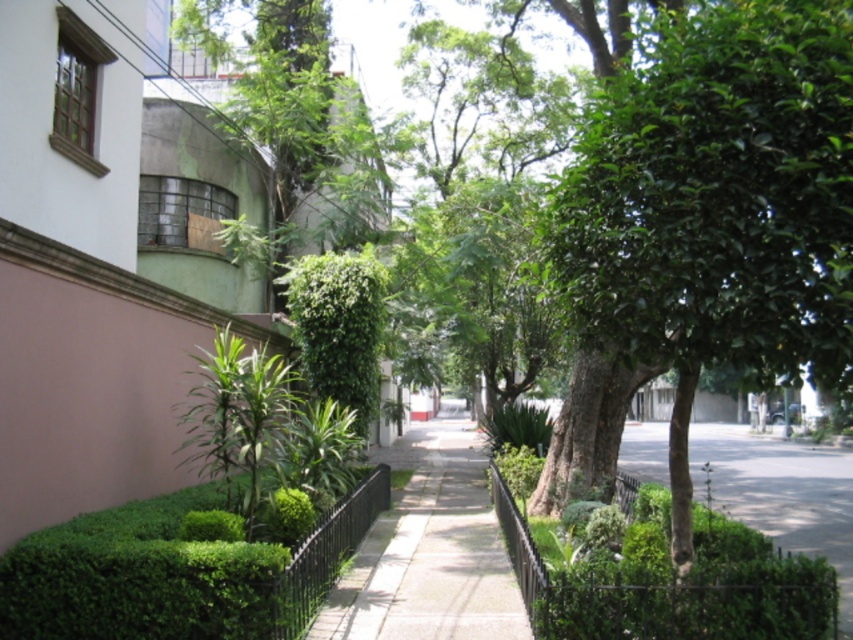
Question: Based on their relative distances, which object is nearer to the paved concrete sidewalk at center?

Choices:
 (A) green leafy tree at center
 (B) green leafy hedge at center

Answer: (A)

Question: Observing the image, what is the correct spatial positioning of green leafy hedge at center in reference to paved concrete sidewalk at center?

Choices:
 (A) right
 (B) left

Answer: (B)

Question: Does green leafy tree at center have a larger size compared to paved concrete sidewalk at center?

Choices:
 (A) no
 (B) yes

Answer: (A)

Question: Which of these objects is positioned closest to the paved concrete sidewalk at center?

Choices:
 (A) green leafy hedge at center
 (B) green leafy tree at center

Answer: (B)

Question: Does green leafy hedge at center have a greater width compared to paved concrete sidewalk at center?

Choices:
 (A) no
 (B) yes

Answer: (A)

Question: Which point appears closest to the camera in this image?

Choices:
 (A) 27,628
 (B) 421,630
 (C) 811,51

Answer: (C)